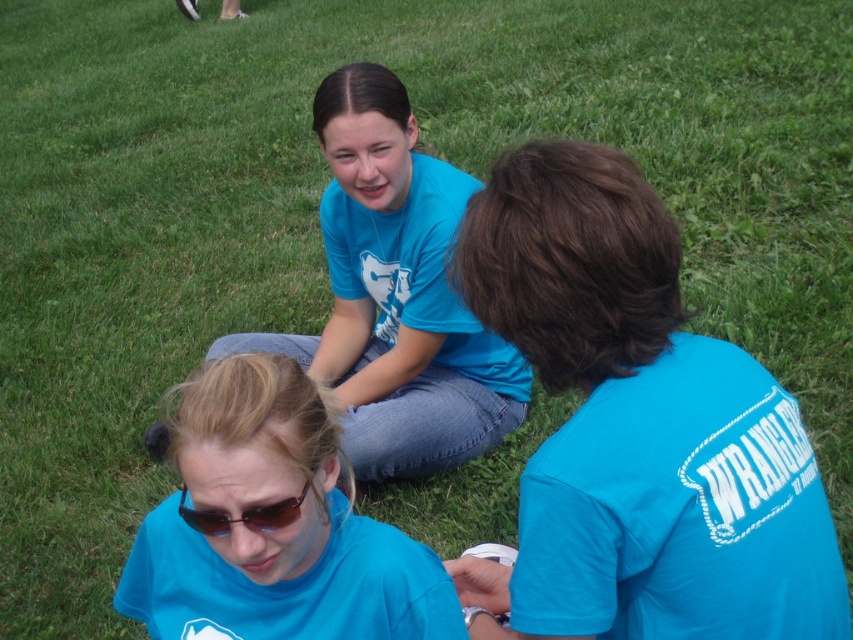
Is matte blue shirt at center to the right of matte blue shirt at lower center from the viewer's perspective?

Indeed, matte blue shirt at center is positioned on the right side of matte blue shirt at lower center.

Which of these two, matte blue shirt at center or matte blue shirt at lower center, stands shorter?

matte blue shirt at lower center is shorter.

Which is behind, point (715, 420) or point (224, 570)?

The point (224, 570) is behind.

Identify the location of matte blue shirt at center. (636, 429).

Who is more distant from viewer, (281, 372) or (204, 522)?

The point (281, 372) is more distant.

Measure the distance between matte blue shirt at lower center and sunglasses at center.

matte blue shirt at lower center and sunglasses at center are 4.18 inches apart from each other.

What do you see at coordinates (271, 525) in the screenshot?
I see `matte blue shirt at lower center` at bounding box center [271, 525].

This screenshot has width=853, height=640. I want to click on matte blue shirt at lower center, so [x=271, y=525].

Which of these two, matte blue shirt at center or matte blue t-shirt at center, stands taller?

matte blue t-shirt at center is taller.

Can you confirm if matte blue shirt at center is smaller than matte blue t-shirt at center?

Correct, matte blue shirt at center occupies less space than matte blue t-shirt at center.

Where is `matte blue shirt at center`? matte blue shirt at center is located at coordinates (636, 429).

At what (x,y) coordinates should I click in order to perform the action: click on matte blue shirt at center. Please return your answer as a coordinate pair (x, y). Looking at the image, I should click on (636, 429).